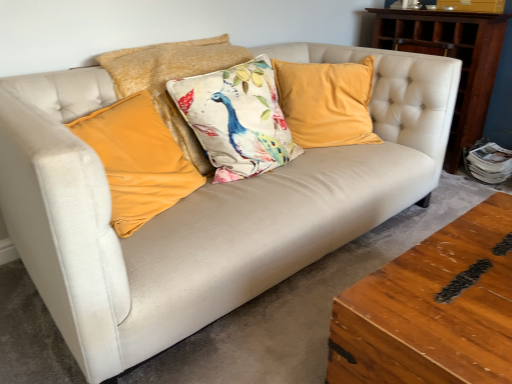
Question: Considering the relative positions of velvet peacock pillow at center, which is counted as the 2th pillow, starting from the right, and wooden dresser at right in the image provided, is velvet peacock pillow at center, which is counted as the 2th pillow, starting from the right, to the right of wooden dresser at right from the viewer's perspective?

Choices:
 (A) no
 (B) yes

Answer: (A)

Question: Is velvet peacock pillow at center, which is counted as the 2th pillow, starting from the right, taller than wooden dresser at right?

Choices:
 (A) no
 (B) yes

Answer: (A)

Question: Considering the relative sizes of velvet peacock pillow at center, which is counted as the 2th pillow, starting from the right, and wooden dresser at right in the image provided, is velvet peacock pillow at center, which is counted as the 2th pillow, starting from the right, smaller than wooden dresser at right?

Choices:
 (A) yes
 (B) no

Answer: (A)

Question: Does velvet peacock pillow at center, the 3th pillow when ordered from left to right, contain wooden dresser at right?

Choices:
 (A) no
 (B) yes

Answer: (A)

Question: Is velvet peacock pillow at center, which is counted as the 2th pillow, starting from the right, outside of wooden dresser at right?

Choices:
 (A) yes
 (B) no

Answer: (A)

Question: Does velvet peacock pillow at center, which is counted as the 2th pillow, starting from the right, come behind wooden dresser at right?

Choices:
 (A) yes
 (B) no

Answer: (B)

Question: From the image's perspective, would you say velvet peacock pillow at center, the 3th pillow when ordered from left to right, is positioned over velvet mustard pillow at left, the 4th pillow viewed from the right?

Choices:
 (A) yes
 (B) no

Answer: (A)

Question: Is velvet peacock pillow at center, which is counted as the 2th pillow, starting from the right, oriented away from velvet mustard pillow at left, placed as the first pillow when sorted from left to right?

Choices:
 (A) yes
 (B) no

Answer: (B)

Question: Can you confirm if velvet peacock pillow at center, which is counted as the 2th pillow, starting from the right, is thinner than velvet mustard pillow at left, placed as the first pillow when sorted from left to right?

Choices:
 (A) yes
 (B) no

Answer: (B)

Question: Is velvet peacock pillow at center, which is counted as the 2th pillow, starting from the right, directly adjacent to velvet mustard pillow at left, placed as the first pillow when sorted from left to right?

Choices:
 (A) no
 (B) yes

Answer: (A)

Question: Is velvet peacock pillow at center, the 3th pillow when ordered from left to right, taller than velvet mustard pillow at left, placed as the first pillow when sorted from left to right?

Choices:
 (A) yes
 (B) no

Answer: (A)

Question: From a real-world perspective, is velvet peacock pillow at center, which is counted as the 2th pillow, starting from the right, physically below velvet mustard pillow at left, placed as the first pillow when sorted from left to right?

Choices:
 (A) no
 (B) yes

Answer: (A)

Question: Is velvet yellow pillow at center, the fourth pillow positioned from the left, positioned far away from wooden dresser at right?

Choices:
 (A) no
 (B) yes

Answer: (A)